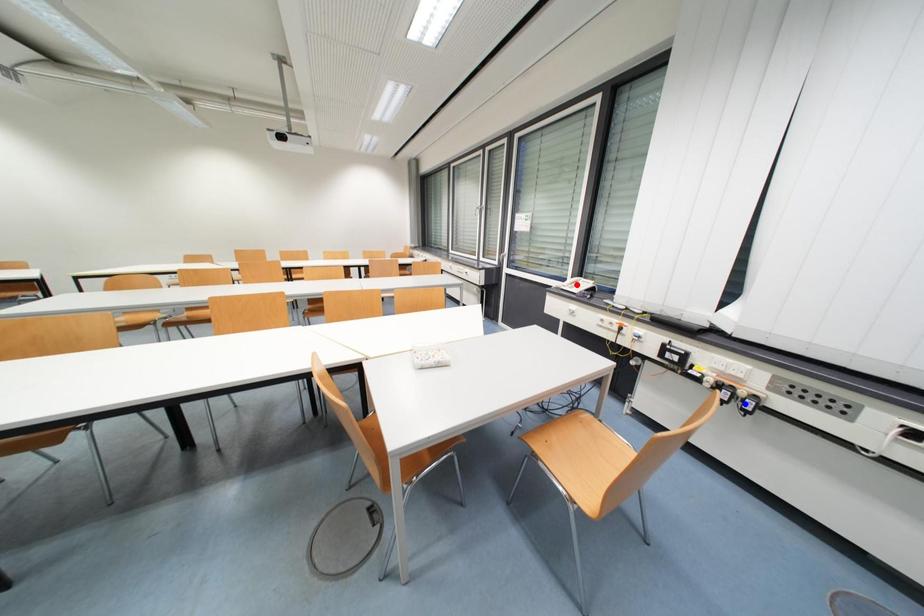
Question: Which of the two points in the image is closer to the camera?

Choices:
 (A) Blue point is closer.
 (B) Red point is closer.

Answer: (A)